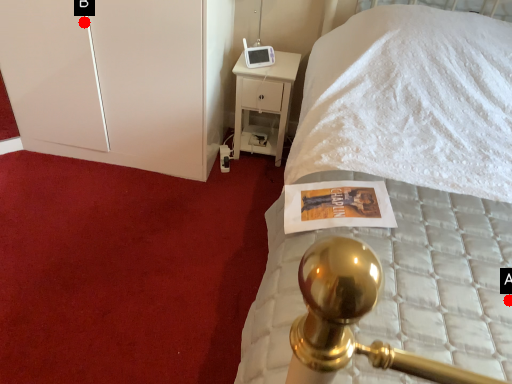
Question: Two points are circled on the image, labeled by A and B beside each circle. Among these points, which one is farthest from the camera?

Choices:
 (A) A is further
 (B) B is further

Answer: (B)